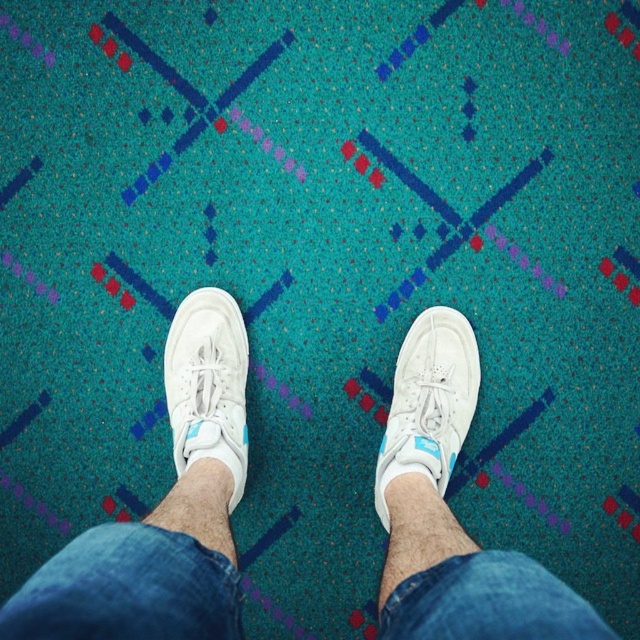
Question: Is white leather sneaker at center above white suede sneaker at center?

Choices:
 (A) yes
 (B) no

Answer: (B)

Question: Is white leather sneaker at center thinner than white suede sneaker at center?

Choices:
 (A) no
 (B) yes

Answer: (A)

Question: Is white leather sneaker at center behind white suede sneaker at center?

Choices:
 (A) yes
 (B) no

Answer: (B)